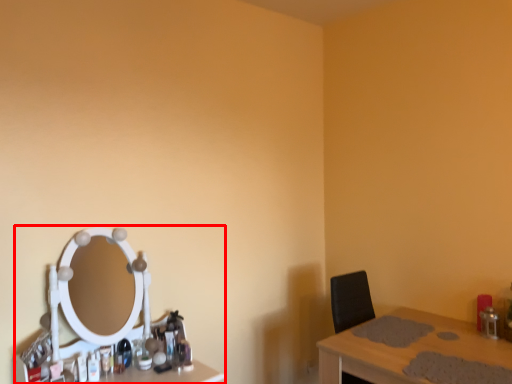
Question: From the image's perspective, considering the relative positions of computer desk (annotated by the red box) and table in the image provided, where is computer desk (annotated by the red box) located with respect to the staircase?

Choices:
 (A) above
 (B) below

Answer: (A)